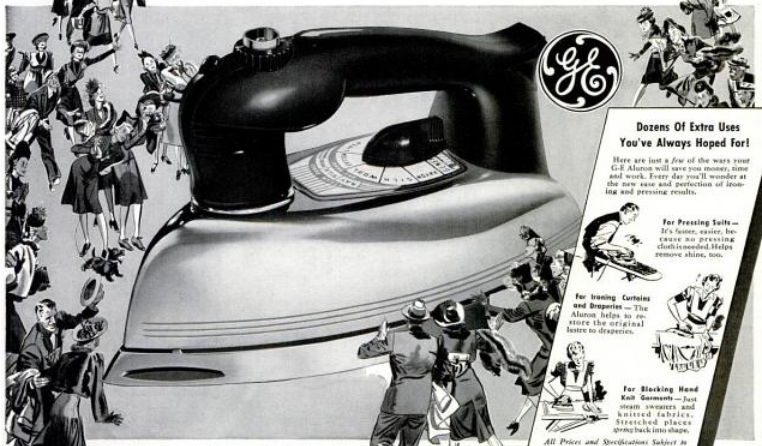
I want to click on handle, so click(x=363, y=56).